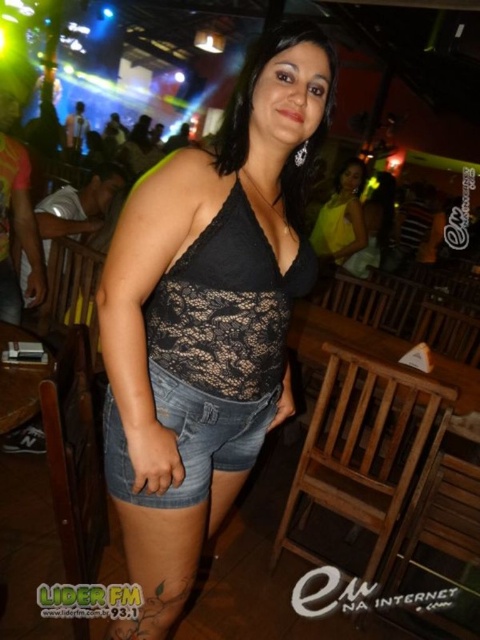
Question: Is black lace top at center bigger than denim shorts at center?

Choices:
 (A) yes
 (B) no

Answer: (A)

Question: Can you confirm if black lace top at center is wider than denim shorts at center?

Choices:
 (A) no
 (B) yes

Answer: (B)

Question: Can you confirm if black lace top at center is positioned to the right of yellow satin dress at center?

Choices:
 (A) yes
 (B) no

Answer: (B)

Question: Which is nearer to the yellow satin dress at center?

Choices:
 (A) black lace top at center
 (B) denim shorts at center

Answer: (A)

Question: Among these objects, which one is nearest to the camera?

Choices:
 (A) black lace top at center
 (B) denim shorts at center
 (C) yellow satin dress at center

Answer: (A)

Question: Which object appears farthest from the camera in this image?

Choices:
 (A) yellow satin dress at center
 (B) black lace top at center
 (C) denim shorts at center

Answer: (A)